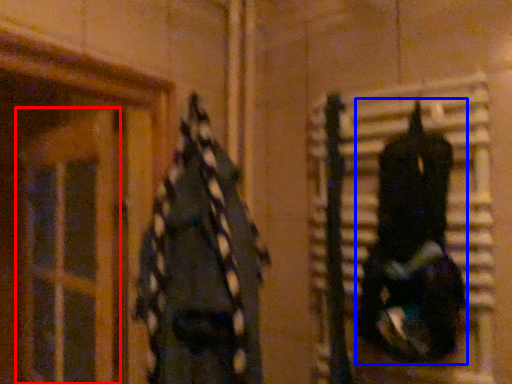
Question: Which of the following is the farthest to the observer, glass door (highlighted by a red box) or clothing (highlighted by a blue box)?

Choices:
 (A) glass door
 (B) clothing

Answer: (A)